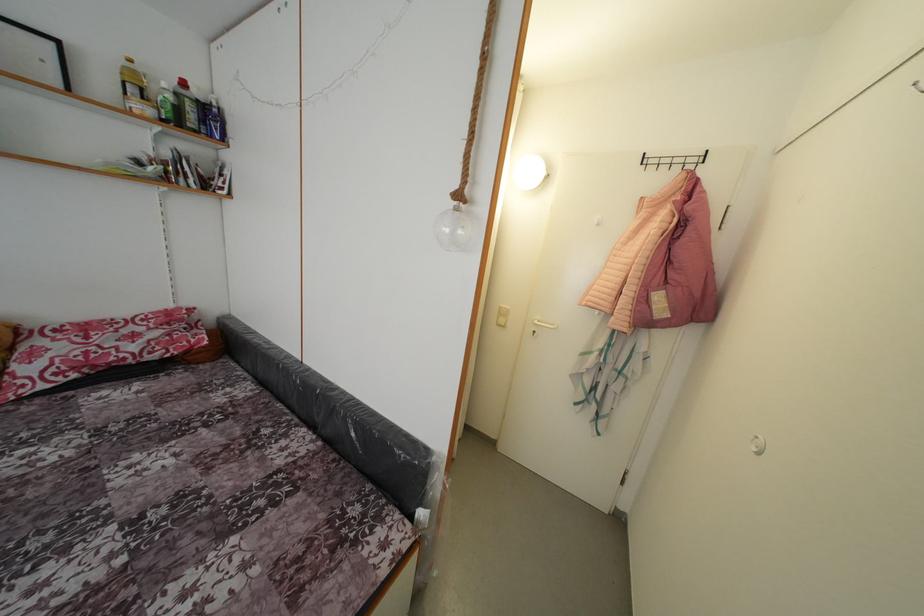
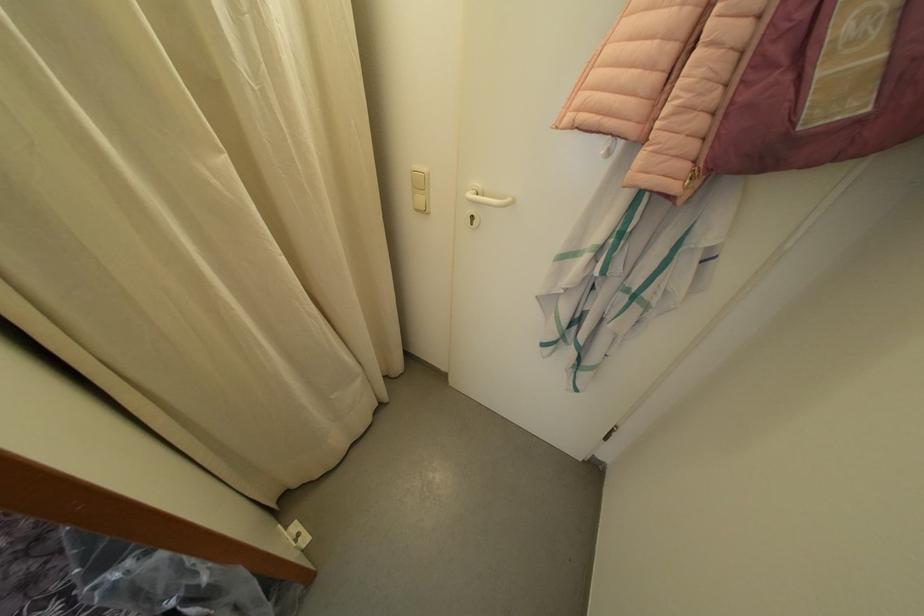
Locate, in the second image, the point that corresponds to (x=508, y=320) in the first image.

(427, 191)